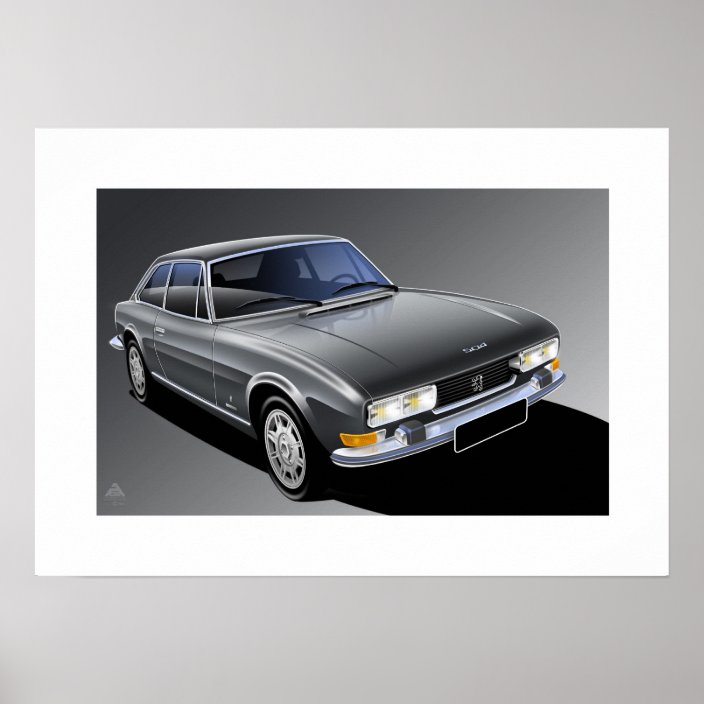
You are a GUI agent. You are given a task and a screenshot of the screen. Output one action in this format:
    pyautogui.click(x=<x>, y=<y>)
    Task: Click on the light
    This screenshot has height=704, width=704.
    Given the screenshot: What is the action you would take?
    click(x=410, y=395)